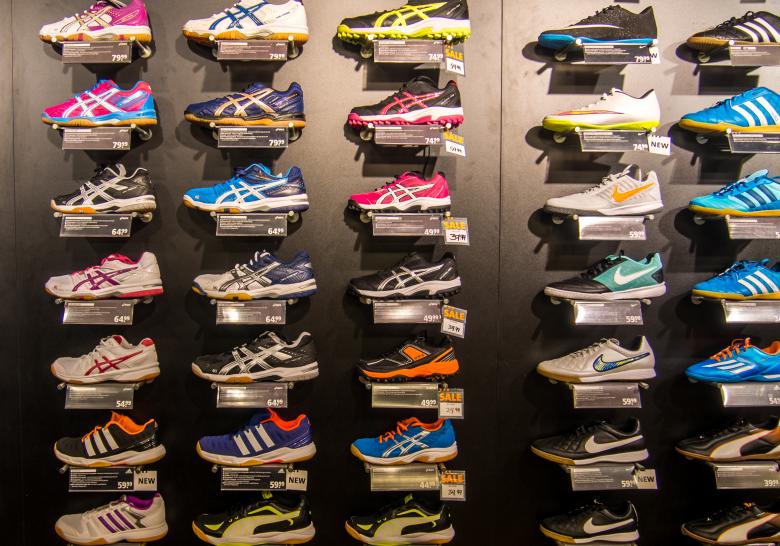
Image resolution: width=780 pixels, height=546 pixels. I want to click on bottom row of shoes, so click(x=132, y=517), click(x=274, y=523), click(x=413, y=521), click(x=605, y=518), click(x=743, y=520).